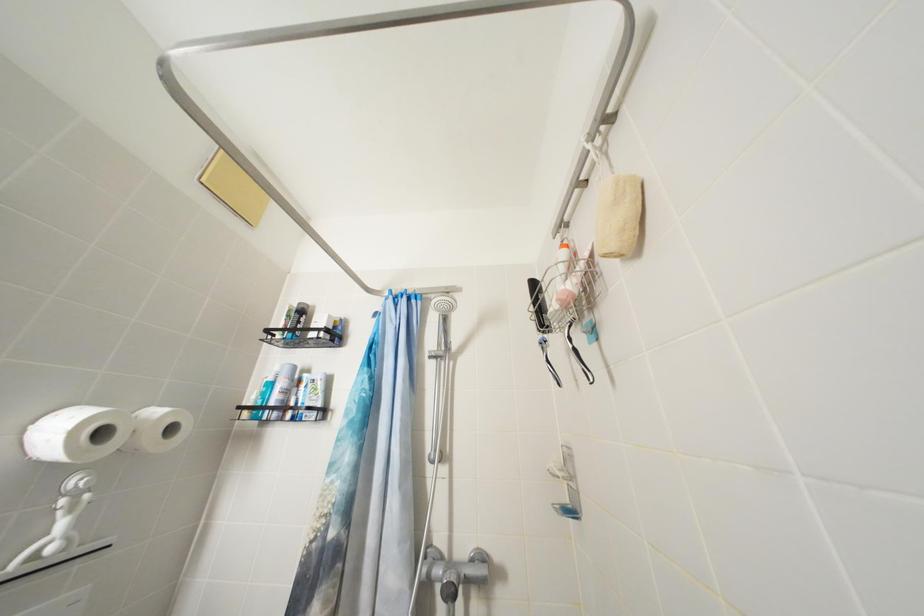
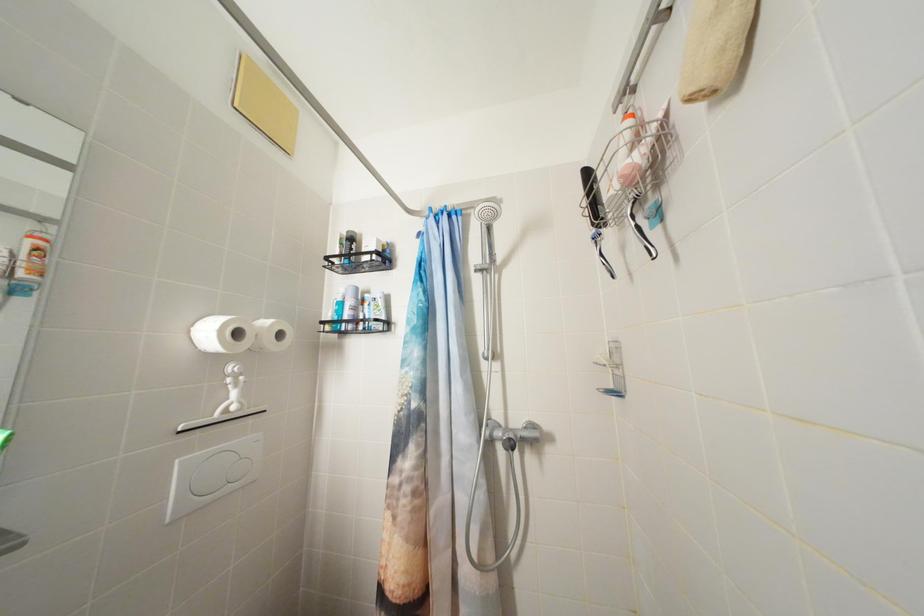
In a continuous first-person perspective shot, in which direction is the camera moving?

The cameraman moved toward left, backward.